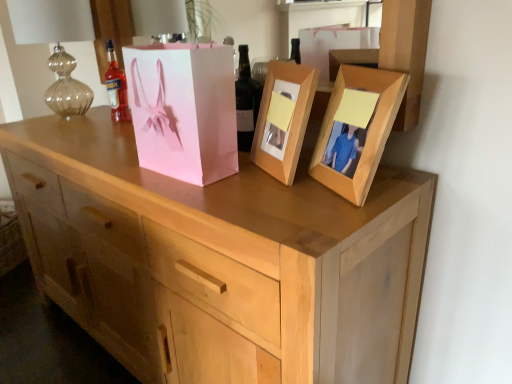
At what (x,y) coordinates should I click in order to perform the action: click on free space in front of translucent glass bottle at upper left, which is the second bottle from front to back. Please return your answer as a coordinate pair (x, y). Looking at the image, I should click on (96, 135).